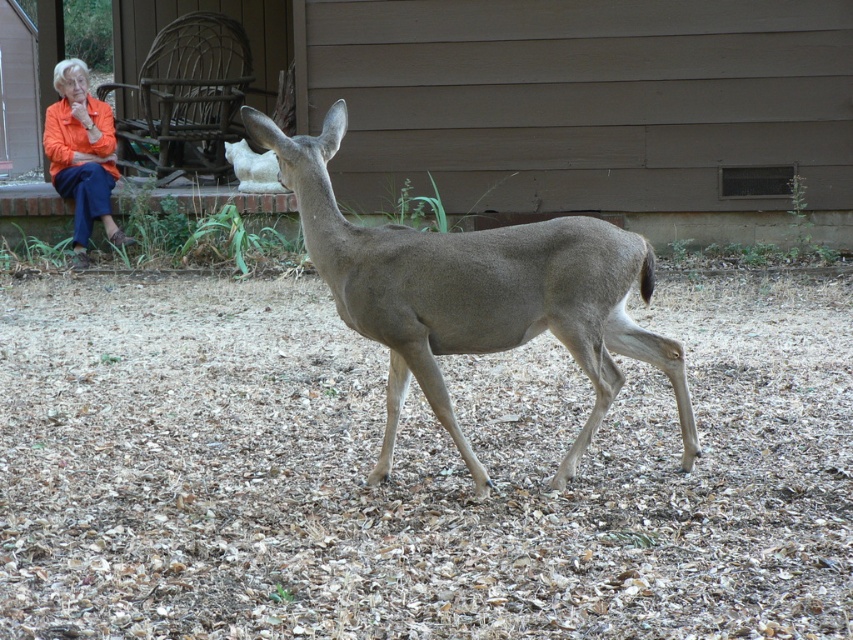
Question: Is gray matte deer at center further to camera compared to orange fabric jacket at upper left?

Choices:
 (A) yes
 (B) no

Answer: (B)

Question: Estimate the real-world distances between objects in this image. Which object is farther from the white fur at center?

Choices:
 (A) gray matte deer at center
 (B) orange fabric jacket at upper left

Answer: (A)

Question: Among these points, which one is nearest to the camera?

Choices:
 (A) (108, 230)
 (B) (234, 168)

Answer: (A)

Question: Considering the real-world distances, which object is farthest from the gray matte deer at center?

Choices:
 (A) orange fabric jacket at upper left
 (B) white fur at center

Answer: (A)

Question: Can you confirm if gray matte deer at center is wider than orange fabric jacket at upper left?

Choices:
 (A) yes
 (B) no

Answer: (A)

Question: Is gray matte deer at center positioned at the back of white fur at center?

Choices:
 (A) yes
 (B) no

Answer: (B)